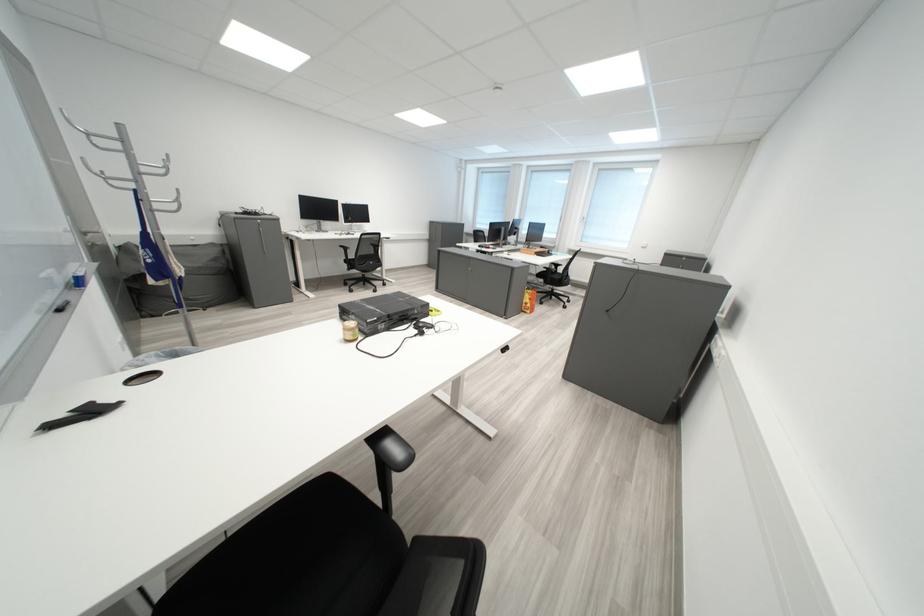
Where would you writ the blue marker? Please return your answer as a coordinate pair (x, y).

(161, 265)